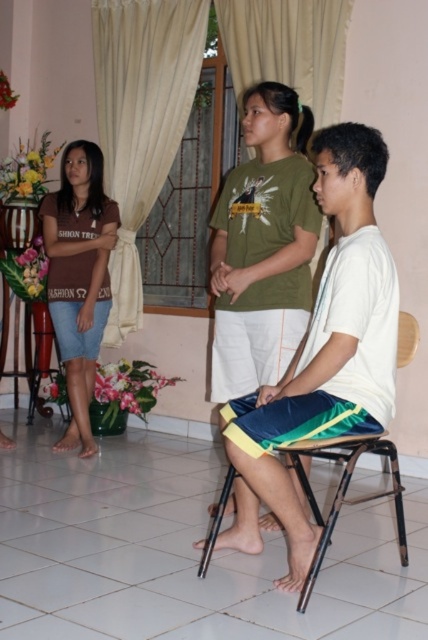
Question: Is white fabric shirt at center thinner than beige fabric curtain at upper left?

Choices:
 (A) no
 (B) yes

Answer: (B)

Question: From the image, what is the correct spatial relationship of green cotton t-shirt at center in relation to beige fabric curtain at upper left?

Choices:
 (A) left
 (B) right

Answer: (B)

Question: Can you confirm if matte brown shirt at left is positioned to the right of white sheer curtain at upper center?

Choices:
 (A) no
 (B) yes

Answer: (A)

Question: Which of the following is the farthest from the observer?

Choices:
 (A) white fabric shirt at center
 (B) white sheer curtain at upper center
 (C) green cotton t-shirt at center

Answer: (B)

Question: Which of the following is the closest to the observer?

Choices:
 (A) (305, 403)
 (B) (86, 182)
 (C) (320, 24)
 (D) (115, 84)

Answer: (A)

Question: Among these points, which one is farthest from the camera?

Choices:
 (A) (160, 1)
 (B) (273, 138)

Answer: (A)